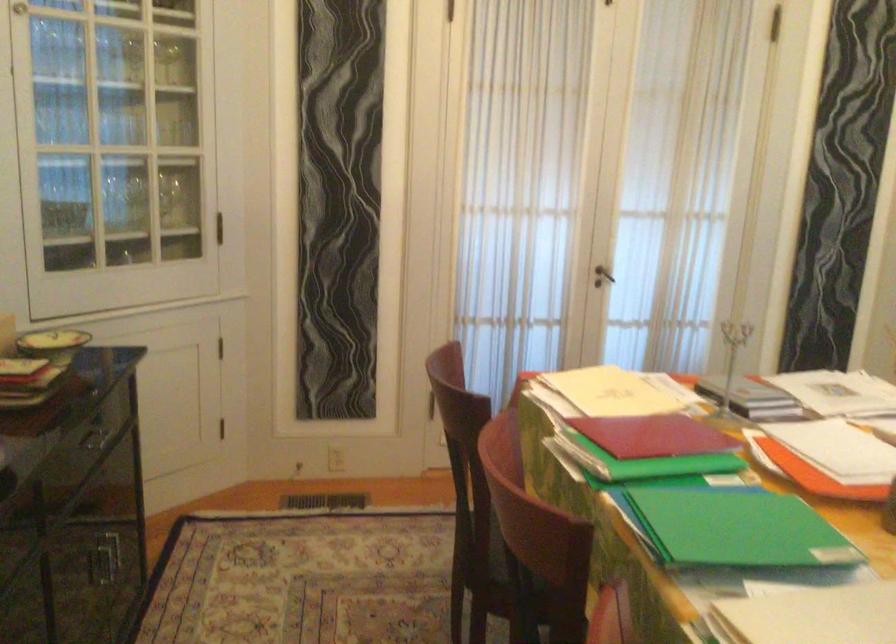
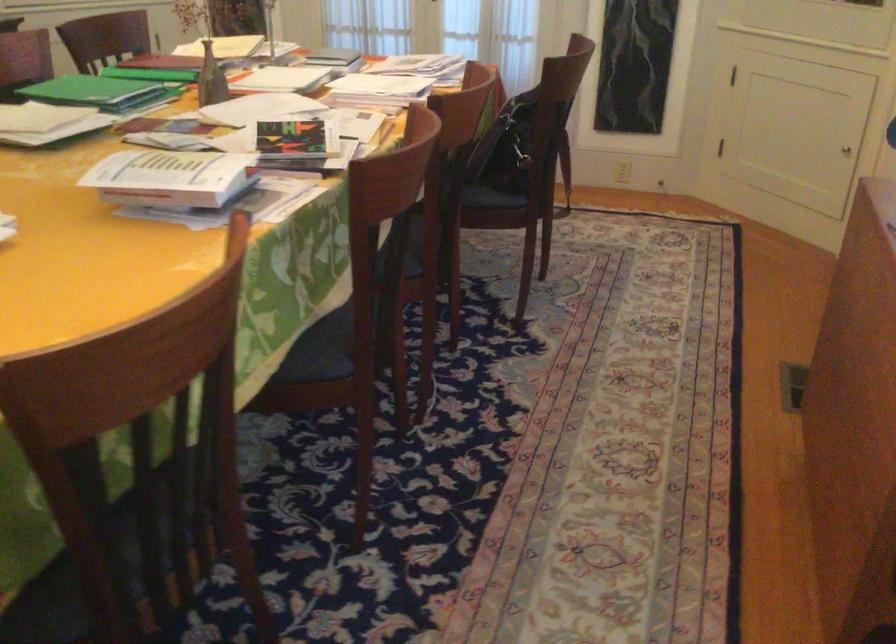
Find the pixel in the second image that matches [787,552] in the first image.

(99, 91)